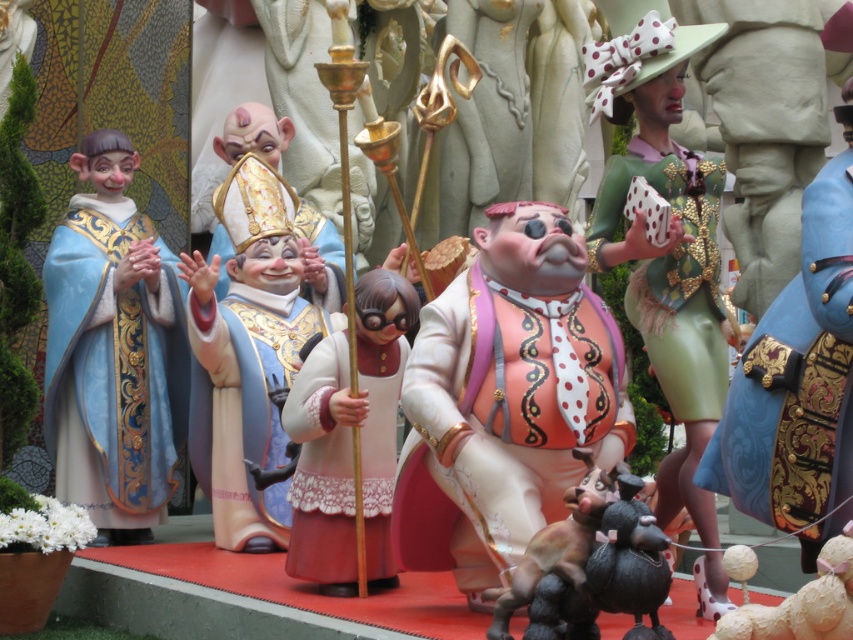
Question: Is white textured dog at lower right positioned in front of brown fur dog at center?

Choices:
 (A) yes
 (B) no

Answer: (A)

Question: Does gold textured robe at center have a greater width compared to white textured dog at lower right?

Choices:
 (A) no
 (B) yes

Answer: (B)

Question: Which point is closer to the camera?

Choices:
 (A) green fabric dress at upper right
 (B) matte blue fabric at left
 (C) gold textured robe at center

Answer: (A)

Question: Can you confirm if matte pink fabric at center is positioned to the left of white textured dog at lower right?

Choices:
 (A) yes
 (B) no

Answer: (A)

Question: Which point is closer to the camera?

Choices:
 (A) (172, 490)
 (B) (833, 632)

Answer: (B)

Question: Which point is farther to the camera?

Choices:
 (A) brown fur dog at center
 (B) pink glossy doll at center

Answer: (B)